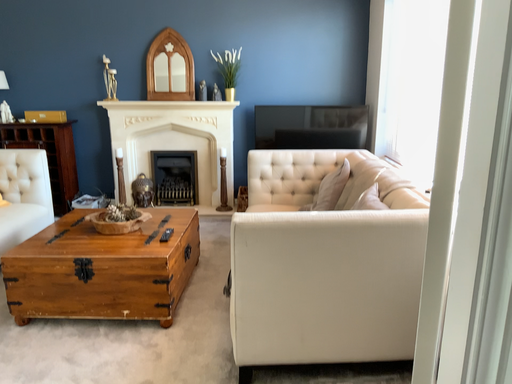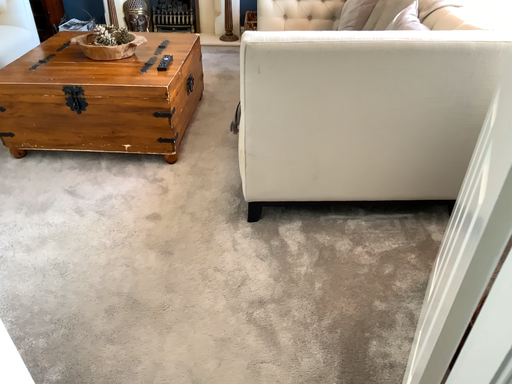
Question: How did the camera likely rotate when shooting the video?

Choices:
 (A) rotated upward
 (B) rotated downward

Answer: (B)